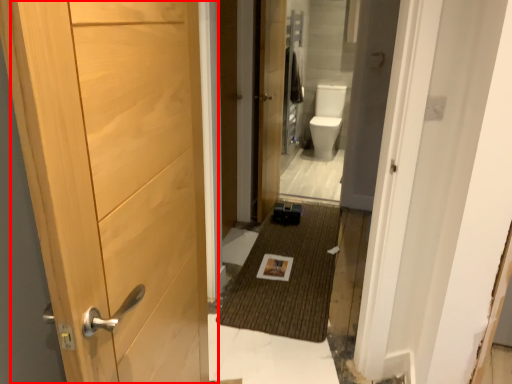
Question: Where is door (annotated by the red box) located in relation to door in the image?

Choices:
 (A) right
 (B) left

Answer: (B)